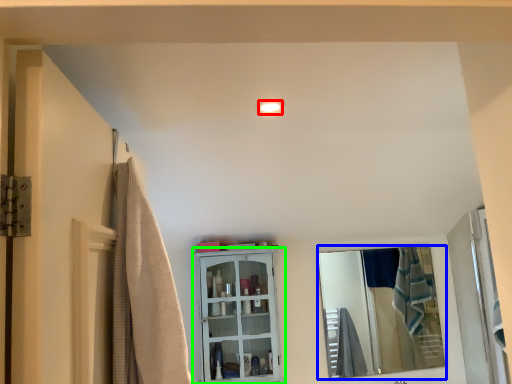
Question: Estimate the real-world distances between objects in this image. Which object is farther from light fixture (highlighted by a red box), mirror (highlighted by a blue box) or cabinetry (highlighted by a green box)?

Choices:
 (A) mirror
 (B) cabinetry

Answer: (A)